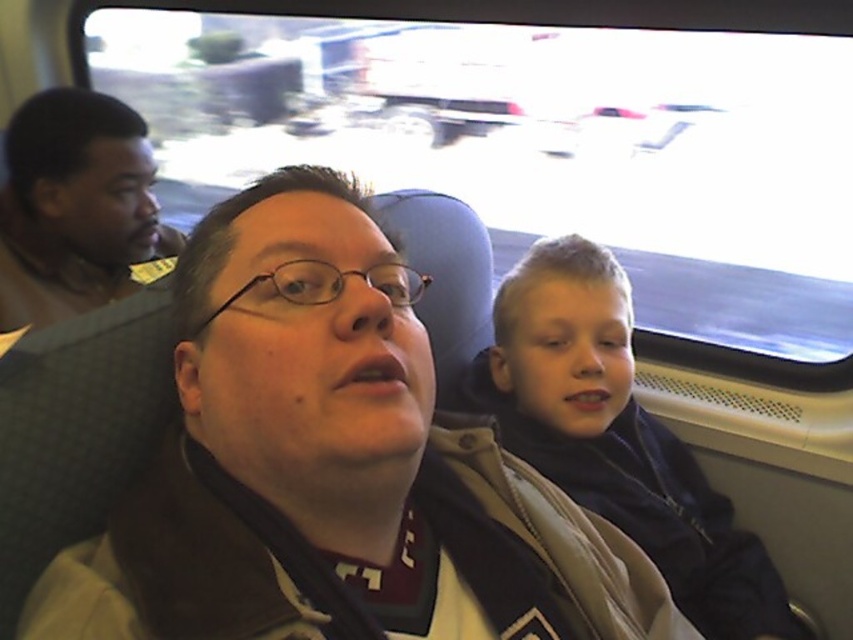
You are a passenger on a moving train or bus and want to know which jacket is closer to the window. The jackets in question are the matte brown jacket at center and the brown leather jacket at left. Can you determine which one is closer to the window based on their positions?

The matte brown jacket at center is positioned under the brown leather jacket at left, meaning the brown leather jacket at left is closer to the window.

You are a passenger on a moving train and want to place a small backpack between the dark blue jacket at center and the brown leather jacket at left. Which jacket should you place it closer to if you want the backpack to be closer to the taller one?

The dark blue jacket at center is taller than the brown leather jacket at left, so placing the backpack closer to the dark blue jacket at center would position it near the taller one.